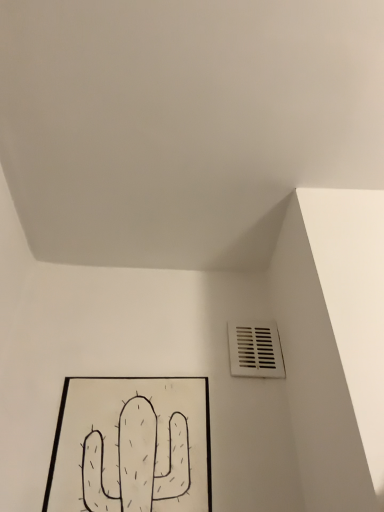
Identify the location of white plastic vent at lower right. (255, 350).

Measure the distance between point (265, 324) and camera.

Point (265, 324) is 3.76 feet from camera.

This screenshot has width=384, height=512. Describe the element at coordinates (255, 350) in the screenshot. I see `white plastic vent at lower right` at that location.

Measure the distance between white plastic vent at lower right and camera.

white plastic vent at lower right and camera are 3.42 feet apart from each other.

At what (x,y) coordinates should I click in order to perform the action: click on black paper at lower left. Please return your answer as a coordinate pair (x, y). This screenshot has height=512, width=384. Looking at the image, I should click on (131, 446).

Describe the element at coordinates (131, 446) in the screenshot. I see `black paper at lower left` at that location.

What is the approximate width of black paper at lower left?

3.03 inches.

Locate an element on the screen. The width and height of the screenshot is (384, 512). white plastic vent at lower right is located at coordinates (255, 350).

Between white plastic vent at lower right and black paper at lower left, which one appears on the left side from the viewer's perspective?

From the viewer's perspective, black paper at lower left appears more on the left side.

Which is in front, white plastic vent at lower right or black paper at lower left?

black paper at lower left is more forward.

Does point (280, 373) come farther from viewer compared to point (56, 496)?

Yes, point (280, 373) is farther from viewer.

From the image's perspective, which one is positioned lower, white plastic vent at lower right or black paper at lower left?

black paper at lower left.

From a real-world perspective, is white plastic vent at lower right positioned above or below black paper at lower left?

Clearly, from a real-world perspective, white plastic vent at lower right is above black paper at lower left.

Can you confirm if white plastic vent at lower right is wider than black paper at lower left?

No, white plastic vent at lower right is not wider than black paper at lower left.

Is white plastic vent at lower right taller or shorter than black paper at lower left?

Clearly, white plastic vent at lower right is shorter compared to black paper at lower left.

Considering the relative sizes of white plastic vent at lower right and black paper at lower left in the image provided, is white plastic vent at lower right smaller than black paper at lower left?

Yes.

Is white plastic vent at lower right situated inside black paper at lower left or outside?

white plastic vent at lower right lies outside black paper at lower left.

Consider the image. Are white plastic vent at lower right and black paper at lower left located far from each other?

white plastic vent at lower right is actually quite close to black paper at lower left.

Is white plastic vent at lower right positioned with its back to black paper at lower left?

No.

From the picture: How different are the orientations of white plastic vent at lower right and black paper at lower left in degrees?

The facing directions of white plastic vent at lower right and black paper at lower left are 2.38 degrees apart.

I want to click on air conditioning that appears above the black paper at lower left (from a real-world perspective), so click(x=255, y=350).

Visually, is black paper at lower left positioned to the left or to the right of white plastic vent at lower right?

From the image, it's evident that black paper at lower left is to the left of white plastic vent at lower right.

Which is in front, black paper at lower left or white plastic vent at lower right?

Positioned in front is black paper at lower left.

Is point (87, 508) closer or farther from the camera than point (270, 344)?

Point (87, 508).

From the image's perspective, relative to white plastic vent at lower right, is black paper at lower left above or below?

black paper at lower left is situated lower than white plastic vent at lower right in the image.

From a real-world perspective, is black paper at lower left above or below white plastic vent at lower right?

black paper at lower left is below white plastic vent at lower right.

Considering the sizes of objects black paper at lower left and white plastic vent at lower right in the image provided, who is thinner, black paper at lower left or white plastic vent at lower right?

Thinner between the two is white plastic vent at lower right.

Can you confirm if black paper at lower left is shorter than white plastic vent at lower right?

No, black paper at lower left is not shorter than white plastic vent at lower right.

Consider the image. Who is smaller, black paper at lower left or white plastic vent at lower right?

Smaller between the two is white plastic vent at lower right.

Would you say black paper at lower left is outside white plastic vent at lower right?

Absolutely, black paper at lower left is external to white plastic vent at lower right.

Are black paper at lower left and white plastic vent at lower right located far from each other?

No, black paper at lower left is in close proximity to white plastic vent at lower right.

Is black paper at lower left facing away from white plastic vent at lower right?

No, white plastic vent at lower right is not at the back of black paper at lower left.

How distant is black paper at lower left from white plastic vent at lower right?

black paper at lower left and white plastic vent at lower right are 10.82 inches apart.

The width and height of the screenshot is (384, 512). Identify the location of air conditioning on the right of black paper at lower left. (255, 350).

You are a GUI agent. You are given a task and a screenshot of the screen. Output one action in this format:
    pyautogui.click(x=<x>, y=<y>)
    Task: Click on the picture frame located on the left of white plastic vent at lower right
    The height and width of the screenshot is (512, 384).
    Given the screenshot: What is the action you would take?
    pyautogui.click(x=131, y=446)

The width and height of the screenshot is (384, 512). Identify the location of picture frame below the white plastic vent at lower right (from the image's perspective). (131, 446).